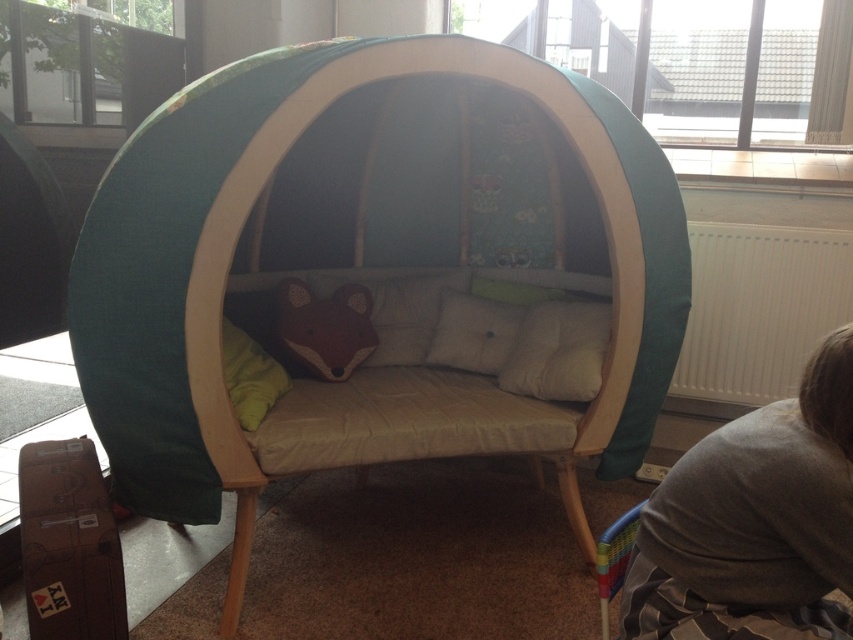
You are a child trying to sit comfortably in the cozy, dome seating area. You see the soft beige cushion at center and the white soft pillow at center. Which one is closer to you when you first enter the seating area?

The soft beige cushion at center is closer to the viewer than the white soft pillow at center, so the soft beige cushion at center is closer when you first enter the seating area.

In the scene shown: You are a child trying to sit comfortably in the cozy dome seating area. You see the soft beige cushion at center and the white soft pillow at center. Which one do you think you can sit on first if you want to sit in the middle?

The soft beige cushion at center is larger in size than the white soft pillow at center, so you can sit on the soft beige cushion at center first as it occupies more space in the middle.

You are a child sitting on the cushioned seat inside the dome. You want to grab the closest pillow to you. Which one should you choose between the brown plush pillow at center and the green soft pillow at center?

The brown plush pillow at center is closer to you than the green soft pillow at center, so you should choose the brown plush pillow at center.